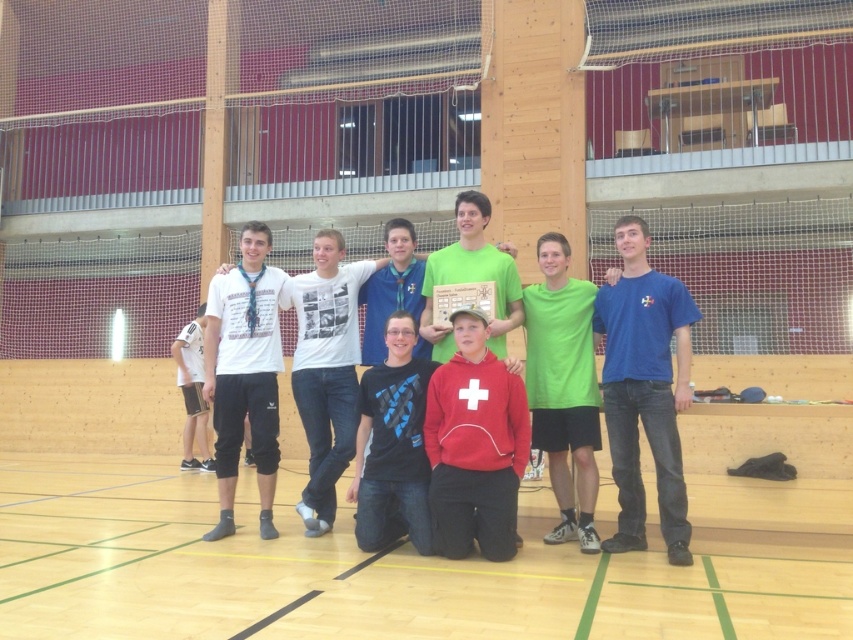
You are standing at the entrance of the gymnasium and see two points marked in the scene. Which point is closer to you, point (564, 296) or point (198, 461)?

Point (564, 296) is in front of point (198, 461), so it is closer to you.